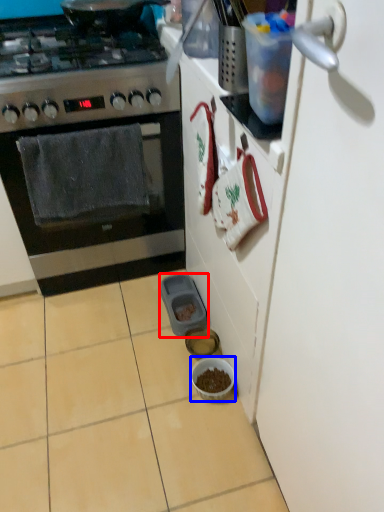
Question: Which point is closer to the camera, appliance (highlighted by a red box) or bowl (highlighted by a blue box)?

Choices:
 (A) appliance
 (B) bowl

Answer: (B)